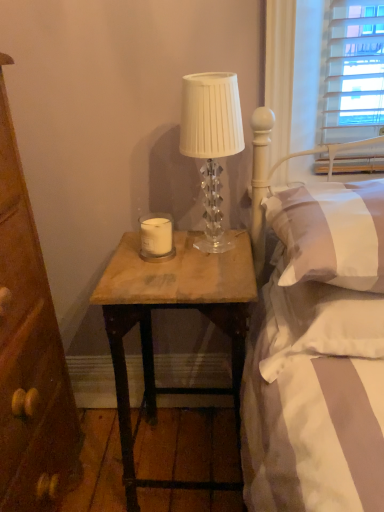
Locate an element on the screen. white matte candle at center is located at coordinates (156, 236).

Based on the photo, what is the approximate height of wooden table at center?

It is 29.14 inches.

Describe the element at coordinates (211, 141) in the screenshot. I see `clear crystal lamp at upper center` at that location.

This screenshot has height=512, width=384. I want to click on white soft pillow at upper right, the first pillow when ordered from top to bottom, so click(x=332, y=233).

Locate an element on the screen. candle above the white soft pillow at right, the 1th pillow positioned from the bottom (from a real-world perspective) is located at coordinates (156, 236).

From the image's perspective, is white matte candle at center positioned above or below white soft pillow at right, the 1th pillow positioned from the bottom?

Clearly, from the image's perspective, white matte candle at center is above white soft pillow at right, the 1th pillow positioned from the bottom.

Is white soft pillow at right, the 2th pillow in the top-to-bottom sequence, located within white matte candle at center?

No, white soft pillow at right, the 2th pillow in the top-to-bottom sequence, is located outside of white matte candle at center.

Is point (377, 189) closer to viewer compared to point (60, 436)?

Yes, it is.

Where is `cabinetry on the left of white soft pillow at upper right, which is the 2th pillow from bottom to top`? cabinetry on the left of white soft pillow at upper right, which is the 2th pillow from bottom to top is located at coordinates (30, 353).

Is white soft pillow at upper right, which is the 2th pillow from bottom to top, taller than brown wood drawer at left?

Incorrect, the height of white soft pillow at upper right, which is the 2th pillow from bottom to top, is not larger of that of brown wood drawer at left.

What's the angular difference between white soft pillow at upper right, which is the 2th pillow from bottom to top, and brown wood drawer at left's facing directions?

The angular difference between white soft pillow at upper right, which is the 2th pillow from bottom to top, and brown wood drawer at left is 91.6 degrees.

Is white soft pillow at right, the 1th pillow positioned from the bottom, further to camera compared to wooden table at center?

That is False.

Is white soft pillow at right, the 2th pillow in the top-to-bottom sequence, facing towards wooden table at center?

No.

Is white soft pillow at right, the 2th pillow in the top-to-bottom sequence, surrounding wooden table at center?

No, wooden table at center is located outside of white soft pillow at right, the 2th pillow in the top-to-bottom sequence.

Who is more distant, white matte candle at center or wooden table at center?

white matte candle at center is further away from the camera.

Considering the sizes of white matte candle at center and wooden table at center in the image, is white matte candle at center taller or shorter than wooden table at center?

Considering their sizes, white matte candle at center has less height than wooden table at center.

From the picture: Is white matte candle at center placed right next to wooden table at center?

No, white matte candle at center is not next to wooden table at center.

Can you tell me how much white matte candle at center and wooden table at center differ in facing direction?

1.04 degrees separate the facing orientations of white matte candle at center and wooden table at center.

Is wooden table at center with white soft pillow at upper right, which is the 2th pillow from bottom to top?

No, wooden table at center is not with white soft pillow at upper right, which is the 2th pillow from bottom to top.

Between wooden table at center and white soft pillow at upper right, the first pillow when ordered from top to bottom, which one appears on the left side from the viewer's perspective?

From the viewer's perspective, wooden table at center appears more on the left side.

From the image's perspective, which is below, wooden table at center or white soft pillow at upper right, which is the 2th pillow from bottom to top?

wooden table at center appears lower in the image.

Is point (15, 509) more distant than point (157, 241)?

No, (15, 509) is closer to viewer.

Can you confirm if brown wood drawer at left is positioned to the right of white matte candle at center?

No.

Who is taller, brown wood drawer at left or white matte candle at center?

brown wood drawer at left.

Considering the relative sizes of brown wood drawer at left and white matte candle at center in the image provided, is brown wood drawer at left smaller than white matte candle at center?

Incorrect, brown wood drawer at left is not smaller in size than white matte candle at center.

Which is correct: white soft pillow at right, the 2th pillow in the top-to-bottom sequence, is inside white soft pillow at upper right, which is the 2th pillow from bottom to top, or outside of it?

white soft pillow at right, the 2th pillow in the top-to-bottom sequence, is not enclosed by white soft pillow at upper right, which is the 2th pillow from bottom to top.

The width and height of the screenshot is (384, 512). In the image, there is a white soft pillow at upper right, which is the 2th pillow from bottom to top. What are the coordinates of `pillow below it (from the image's perspective)` in the screenshot? It's located at (321, 317).

From a real-world perspective, is white soft pillow at right, the 2th pillow in the top-to-bottom sequence, over white soft pillow at upper right, the first pillow when ordered from top to bottom?

Actually, white soft pillow at right, the 2th pillow in the top-to-bottom sequence, is physically below white soft pillow at upper right, the first pillow when ordered from top to bottom, in the real world.

Which is in front, point (309, 298) or point (297, 276)?

Positioned in front is point (297, 276).

Find the location of a particular element. pillow beneath the white matte candle at center (from a real-world perspective) is located at coordinates (321, 317).

The width and height of the screenshot is (384, 512). I want to click on cabinetry to the left of white soft pillow at upper right, which is the 2th pillow from bottom to top, so point(30,353).

From the image, which object appears to be nearer to white matte candle at center, white soft pillow at upper right, the first pillow when ordered from top to bottom, or clear crystal lamp at upper center?

clear crystal lamp at upper center is positioned closer to the anchor white matte candle at center.

Considering their positions, is wooden table at center positioned further to white soft pillow at upper right, which is the 2th pillow from bottom to top, than white soft pillow at right, the 1th pillow positioned from the bottom?

The object further to white soft pillow at upper right, which is the 2th pillow from bottom to top, is wooden table at center.

From the image, which object appears to be farther from wooden table at center, white soft pillow at upper right, which is the 2th pillow from bottom to top, or clear crystal lamp at upper center?

clear crystal lamp at upper center is positioned further to the anchor wooden table at center.

Estimate the real-world distances between objects in this image. Which object is closer to wooden table at center, white soft pillow at upper right, the first pillow when ordered from top to bottom, or white soft pillow at right, the 2th pillow in the top-to-bottom sequence?

Among the two, white soft pillow at right, the 2th pillow in the top-to-bottom sequence, is located nearer to wooden table at center.

Considering their positions, is clear crystal lamp at upper center positioned further to wooden table at center than white soft pillow at upper right, the first pillow when ordered from top to bottom?

clear crystal lamp at upper center lies further to wooden table at center than the other object.

Looking at the image, which one is located closer to white matte candle at center, white soft pillow at upper right, which is the 2th pillow from bottom to top, or wooden table at center?

wooden table at center is closer to white matte candle at center.

Estimate the real-world distances between objects in this image. Which object is further from white matte candle at center, brown wood drawer at left or clear crystal lamp at upper center?

brown wood drawer at left is further to white matte candle at center.

Based on their spatial positions, is white matte candle at center or clear crystal lamp at upper center further from wooden table at center?

clear crystal lamp at upper center.

Where is `pillow situated between clear crystal lamp at upper center and white soft pillow at upper right, the first pillow when ordered from top to bottom, from left to right`? This screenshot has height=512, width=384. pillow situated between clear crystal lamp at upper center and white soft pillow at upper right, the first pillow when ordered from top to bottom, from left to right is located at coordinates (321, 317).

Where is `candle located between brown wood drawer at left and white soft pillow at upper right, which is the 2th pillow from bottom to top, in the left-right direction`? The width and height of the screenshot is (384, 512). candle located between brown wood drawer at left and white soft pillow at upper right, which is the 2th pillow from bottom to top, in the left-right direction is located at coordinates (156, 236).

The width and height of the screenshot is (384, 512). Find the location of `lamp located between brown wood drawer at left and white soft pillow at right, the 2th pillow in the top-to-bottom sequence, in the left-right direction`. lamp located between brown wood drawer at left and white soft pillow at right, the 2th pillow in the top-to-bottom sequence, in the left-right direction is located at coordinates (211, 141).

I want to click on lamp between brown wood drawer at left and white soft pillow at upper right, the first pillow when ordered from top to bottom, from left to right, so click(211, 141).